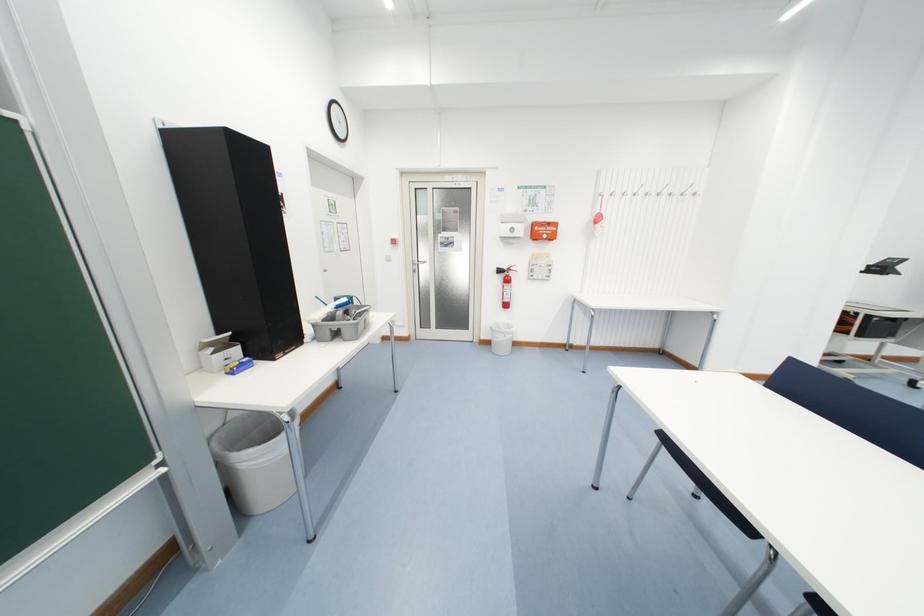
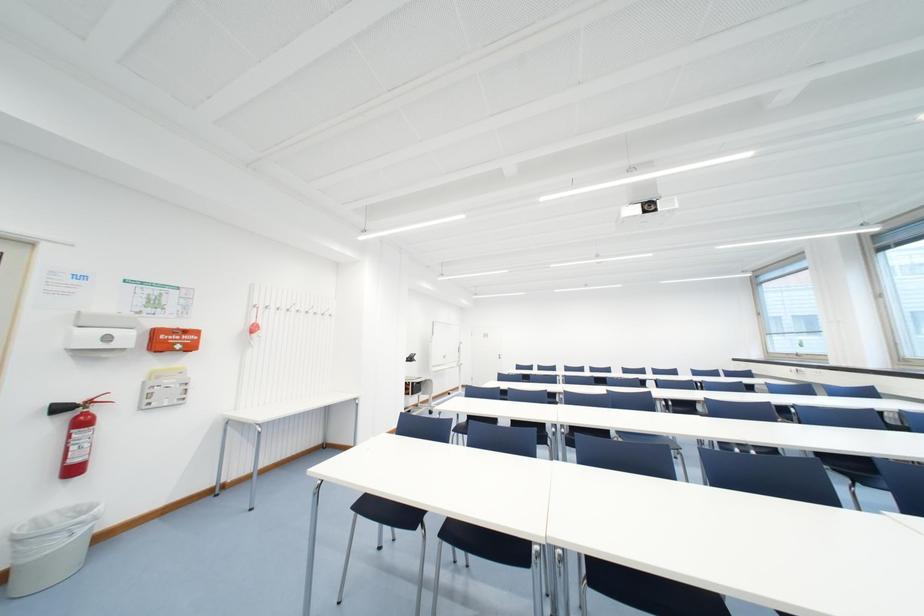
Question: How did the camera likely rotate?

Choices:
 (A) Left
 (B) Right
 (C) Up
 (D) Down

Answer: (B)